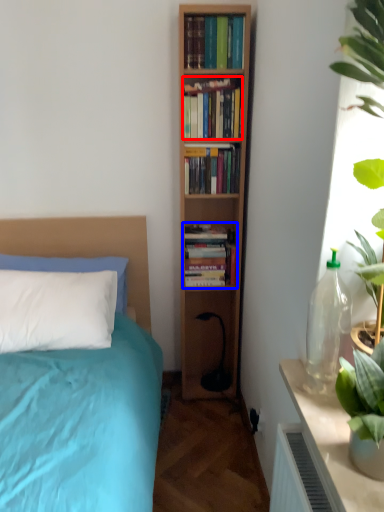
Question: Which object is closer to the camera taking this photo, book (highlighted by a red box) or book (highlighted by a blue box)?

Choices:
 (A) book
 (B) book

Answer: (A)